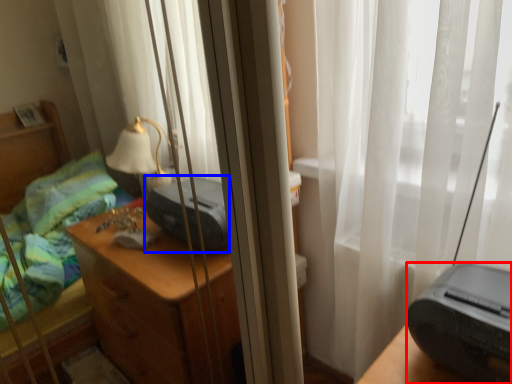
Question: Which object is closer to the camera taking this photo, printer (highlighted by a red box) or printer (highlighted by a blue box)?

Choices:
 (A) printer
 (B) printer

Answer: (A)